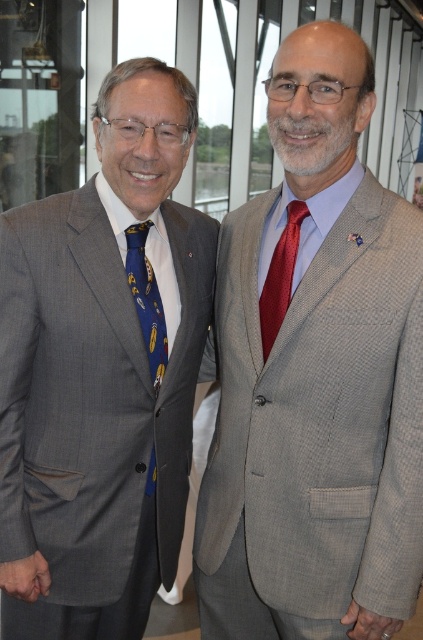
Does matte gray suit at left have a greater height compared to shiny red tie at center?

Indeed, matte gray suit at left has a greater height compared to shiny red tie at center.

Between matte gray suit at left and shiny red tie at center, which one is positioned lower?

matte gray suit at left

Where is `matte gray suit at left`? The width and height of the screenshot is (423, 640). matte gray suit at left is located at coordinates (101, 372).

At what (x,y) coordinates should I click in order to perform the action: click on matte gray suit at left. Please return your answer as a coordinate pair (x, y). The image size is (423, 640). Looking at the image, I should click on (101, 372).

Who is taller, blue silk tie at left or shiny red tie at center?

blue silk tie at left is taller.

Is blue silk tie at left shorter than shiny red tie at center?

In fact, blue silk tie at left may be taller than shiny red tie at center.

Where is `blue silk tie at left`? The width and height of the screenshot is (423, 640). blue silk tie at left is located at coordinates (147, 300).

Which is below, matte gray suit at center or shiny red tie at center?

matte gray suit at center is lower down.

Does matte gray suit at center have a lesser height compared to shiny red tie at center?

No, matte gray suit at center is not shorter than shiny red tie at center.

Which is in front, point (293, 577) or point (279, 252)?

Positioned in front is point (293, 577).

Image resolution: width=423 pixels, height=640 pixels. Identify the location of matte gray suit at center. (315, 376).